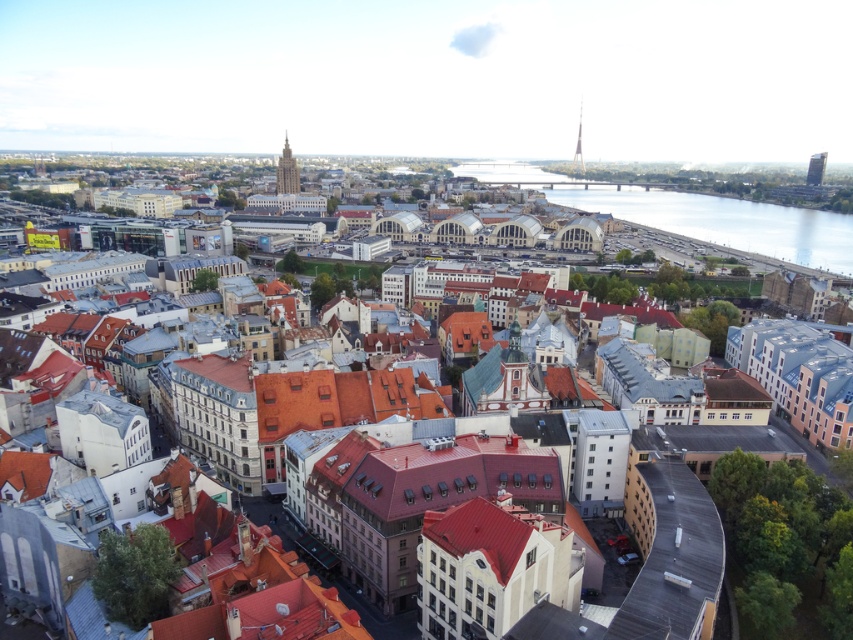
Question: Is matte gray tower at center bigger than smooth glass tower at upper right?

Choices:
 (A) yes
 (B) no

Answer: (A)

Question: Is reflective glass waterway at center closer to the viewer compared to smooth glass skyscraper at right?

Choices:
 (A) no
 (B) yes

Answer: (B)

Question: Which of the following is the closest to the observer?

Choices:
 (A) smooth glass tower at upper right
 (B) reflective glass waterway at center
 (C) matte gray tower at center

Answer: (B)

Question: Which object is positioned farthest from the matte gray tower at center?

Choices:
 (A) smooth glass skyscraper at right
 (B) reflective glass waterway at center

Answer: (A)

Question: Does smooth glass skyscraper at right have a greater width compared to smooth glass tower at upper right?

Choices:
 (A) yes
 (B) no

Answer: (A)

Question: Among these objects, which one is farthest from the camera?

Choices:
 (A) reflective glass waterway at center
 (B) matte gray tower at center
 (C) smooth glass tower at upper right
 (D) smooth glass skyscraper at right

Answer: (C)